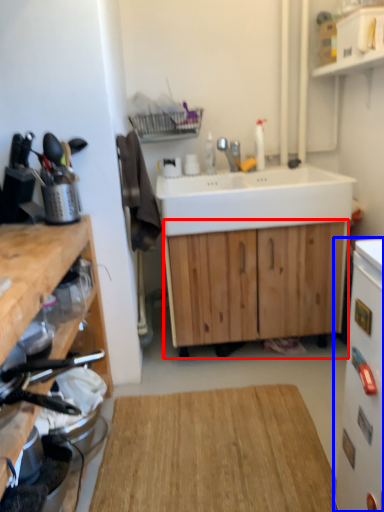
Question: Among these objects, which one is nearest to the camera, cabinetry (highlighted by a red box) or appliance (highlighted by a blue box)?

Choices:
 (A) cabinetry
 (B) appliance

Answer: (B)